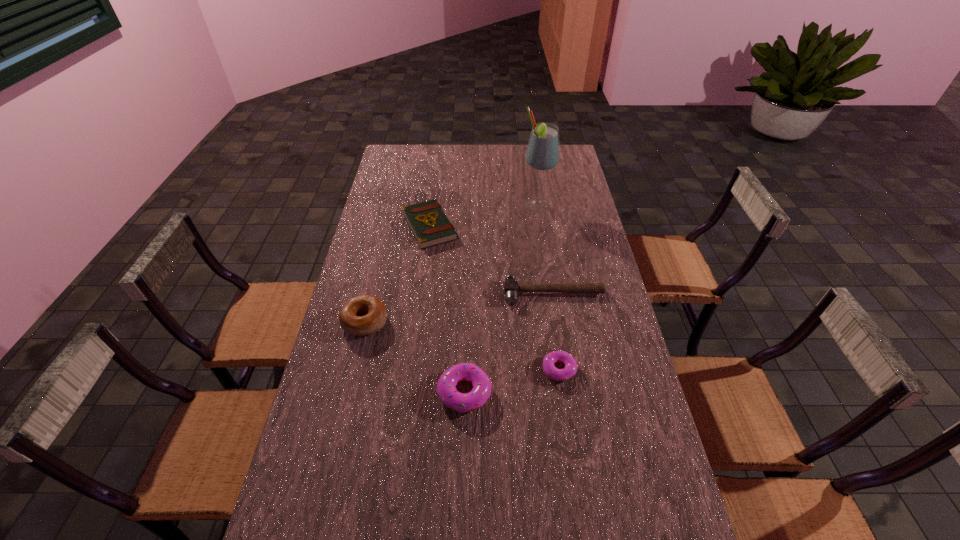
The width and height of the screenshot is (960, 540). I want to click on the left doughnut, so [x=446, y=386].

The width and height of the screenshot is (960, 540). Identify the location of the third tallest object. [x=446, y=386].

Where is `the shorter doughnut`? The image size is (960, 540). the shorter doughnut is located at coordinates (570, 369).

Where is `book`? Image resolution: width=960 pixels, height=540 pixels. book is located at coordinates (428, 222).

Identify the location of alcohol. The height and width of the screenshot is (540, 960). (542, 154).

This screenshot has width=960, height=540. What are the coordinates of `the second tallest object` in the screenshot? It's located at (361, 315).

In order to click on hammer in this screenshot , I will do (x=511, y=287).

At what (x,y) coordinates should I click in order to perform the action: click on free space located 0.130m on the front of the third tallest object. Please return your answer as a coordinate pair (x, y). Looking at the image, I should click on (463, 467).

Where is `free space located 0.240m on the back of the shorter doughnut`? This screenshot has width=960, height=540. free space located 0.240m on the back of the shorter doughnut is located at coordinates (x=548, y=296).

The width and height of the screenshot is (960, 540). I want to click on vacant region located 0.090m on the back of the book, so click(x=434, y=193).